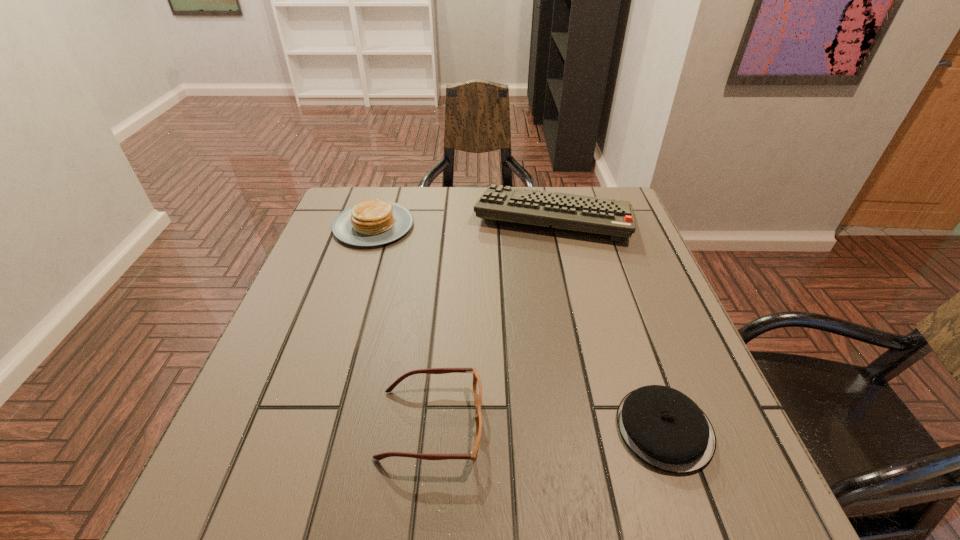
This screenshot has height=540, width=960. In order to click on free location at the far edge of the desktop in this screenshot , I will do `click(474, 227)`.

You are a GUI agent. You are given a task and a screenshot of the screen. Output one action in this format:
    pyautogui.click(x=<x>, y=<y>)
    Task: Click on the vacant space at the near edge of the desktop
    This screenshot has width=960, height=540.
    Given the screenshot: What is the action you would take?
    pyautogui.click(x=549, y=483)

This screenshot has width=960, height=540. In order to click on vacant region at the left edge of the desktop in this screenshot , I will do `click(313, 343)`.

Locate an element on the screen. vacant space at the right edge of the desktop is located at coordinates (642, 334).

The image size is (960, 540). Identify the location of vacant space at the far left corner. (348, 197).

Locate an element on the screen. The height and width of the screenshot is (540, 960). vacant space at the near left corner of the desktop is located at coordinates (204, 494).

You are a GUI agent. You are given a task and a screenshot of the screen. Output one action in this format:
    pyautogui.click(x=<x>, y=<y>)
    Task: Click on the free space at the far right corner of the desktop
    
    Given the screenshot: What is the action you would take?
    pyautogui.click(x=619, y=194)

Where is `vacant area at the near right corner`? This screenshot has height=540, width=960. vacant area at the near right corner is located at coordinates (732, 470).

Where is `free space between the leftmost object and the spectacles`? free space between the leftmost object and the spectacles is located at coordinates (402, 325).

Identify the location of free space between the spectacles and the farther pancake. (402, 325).